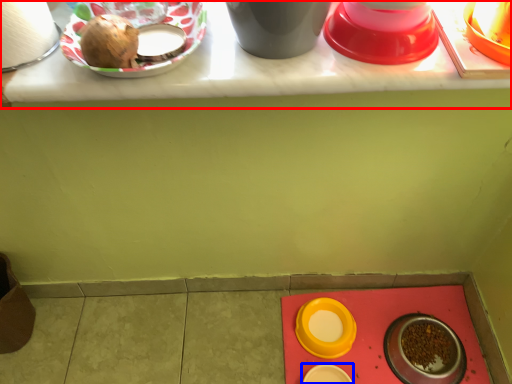
Question: Which object appears closest to the camera in this image, table (highlighted by a red box) or tableware (highlighted by a blue box)?

Choices:
 (A) table
 (B) tableware

Answer: (A)